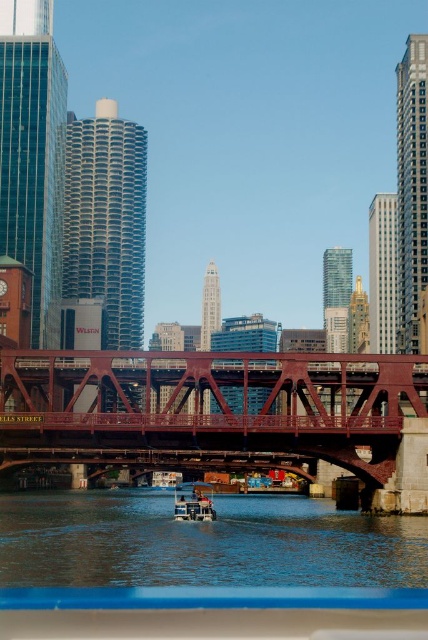
Question: Which point is closer to the camera?

Choices:
 (A) (299, 422)
 (B) (184, 502)

Answer: (A)

Question: Is blue water at center positioned behind metallic blue boat at center?

Choices:
 (A) yes
 (B) no

Answer: (B)

Question: From the image, what is the correct spatial relationship of red steel bridge at center in relation to blue water at center?

Choices:
 (A) above
 (B) below

Answer: (A)

Question: Which object appears farthest from the camera in this image?

Choices:
 (A) red steel bridge at center
 (B) metallic blue boat at center
 (C) blue water at center

Answer: (B)

Question: Which of the following is the farthest from the observer?

Choices:
 (A) red steel bridge at center
 (B) blue water at center
 (C) metallic blue boat at center

Answer: (C)

Question: Can you confirm if red steel bridge at center is positioned to the left of blue water at center?

Choices:
 (A) no
 (B) yes

Answer: (A)